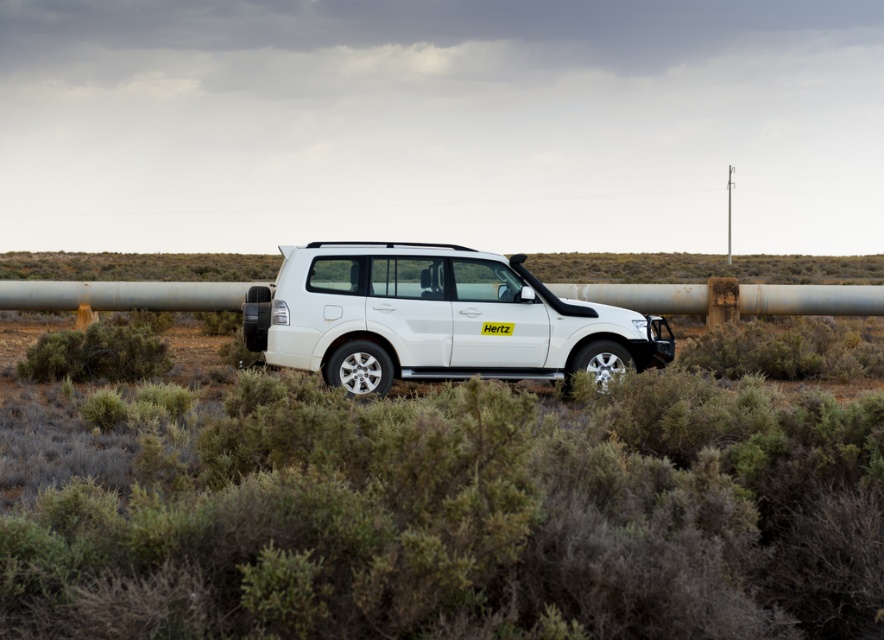
The image size is (884, 640). What do you see at coordinates (444, 512) in the screenshot? I see `green shrubbery at center` at bounding box center [444, 512].

Is point (179, 520) positioned behind point (508, 328)?

No, it is in front of (508, 328).

Does point (827, 547) lie in front of point (524, 371)?

Yes, it is.

What are the coordinates of `green shrubbery at center` in the screenshot? It's located at (444, 512).

Between green shrubbery at center and brown shrub at lower left, which one has more height?

Standing taller between the two is brown shrub at lower left.

Who is positioned more to the right, green shrubbery at center or brown shrub at lower left?

green shrubbery at center

Is point (317, 528) closer to camera compared to point (70, 362)?

Yes, it is in front of point (70, 362).

At what (x,y) coordinates should I click in order to perform the action: click on green shrubbery at center. Please return your answer as a coordinate pair (x, y). Looking at the image, I should click on (444, 512).

Is white matte suv at center to the right of brown shrub at lower left from the viewer's perspective?

Correct, you'll find white matte suv at center to the right of brown shrub at lower left.

What do you see at coordinates (435, 317) in the screenshot? Image resolution: width=884 pixels, height=640 pixels. I see `white matte suv at center` at bounding box center [435, 317].

The image size is (884, 640). I want to click on white matte suv at center, so click(435, 317).